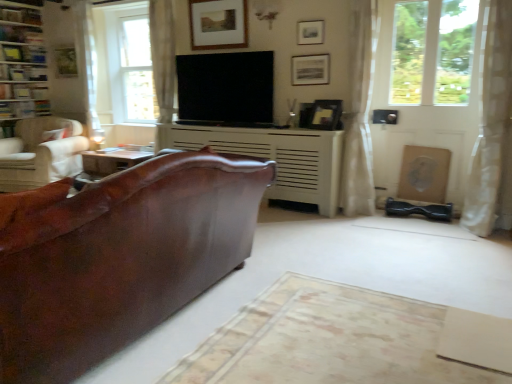
Locate an element on the screen. empty space that is to the right of brown leather couch at center is located at coordinates (337, 300).